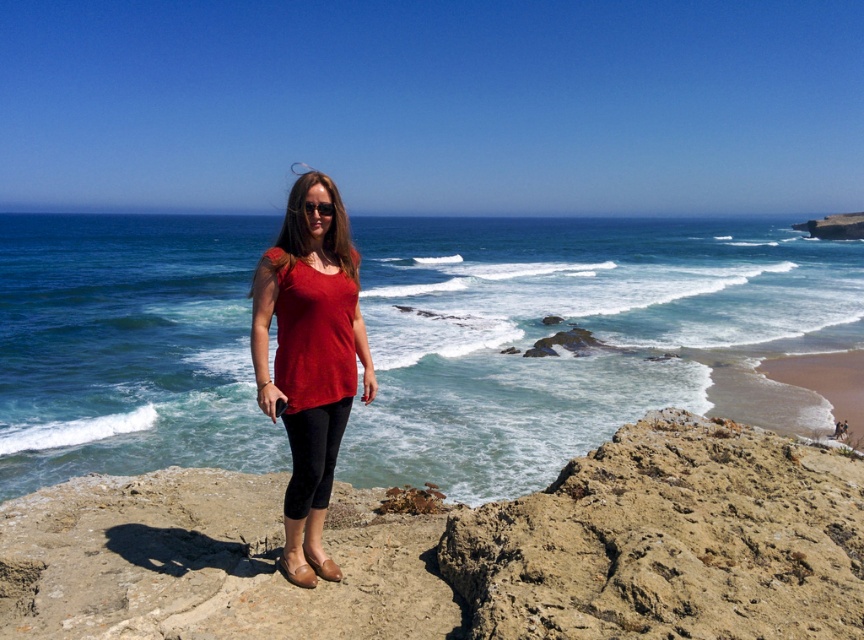
Question: Is blue water at center positioned in front of rough stone cliff at center?

Choices:
 (A) yes
 (B) no

Answer: (B)

Question: Which of the following is the farthest from the observer?

Choices:
 (A) rough stone cliff at center
 (B) matte red blouse at center
 (C) blue water at center

Answer: (C)

Question: Among these objects, which one is farthest from the camera?

Choices:
 (A) matte red blouse at center
 (B) blue water at center

Answer: (B)

Question: Which point is closer to the camera taking this photo?

Choices:
 (A) (256, 244)
 (B) (299, 394)

Answer: (B)

Question: Can you confirm if blue water at center is wider than matte red blouse at center?

Choices:
 (A) yes
 (B) no

Answer: (A)

Question: Does blue water at center appear on the left side of rough stone cliff at center?

Choices:
 (A) no
 (B) yes

Answer: (B)